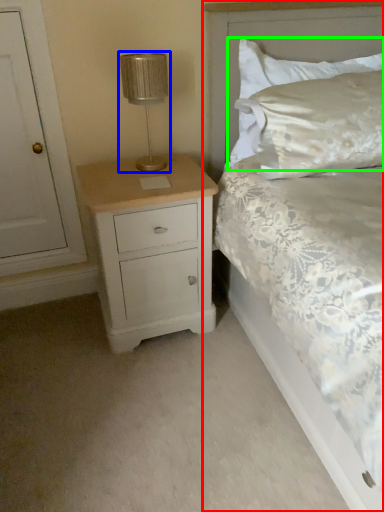
Question: Considering the real-world distances, which object is closest to bed (highlighted by a red box)? table lamp (highlighted by a blue box) or pillow (highlighted by a green box).

Choices:
 (A) table lamp
 (B) pillow

Answer: (B)